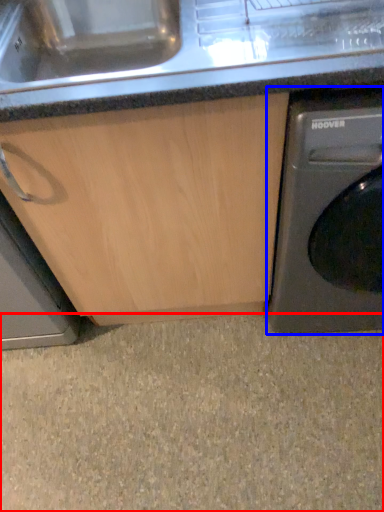
Question: Which object is closer to the camera taking this photo, granite (highlighted by a red box) or washing machine (highlighted by a blue box)?

Choices:
 (A) granite
 (B) washing machine

Answer: (B)